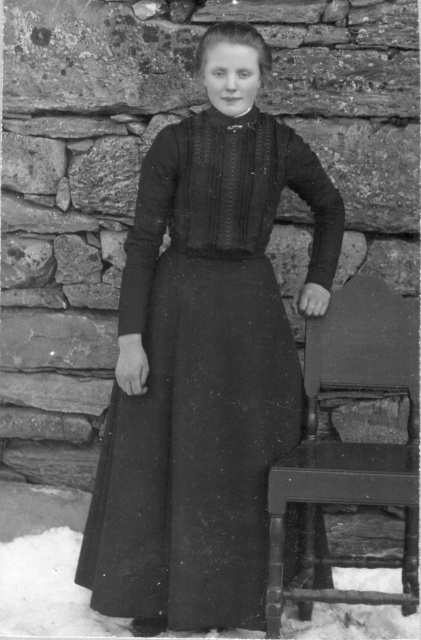
Question: Which of the following is the closest to the observer?

Choices:
 (A) (348, 342)
 (B) (255, 321)
 (C) (90, 627)

Answer: (B)

Question: Is black matte dress at center positioned in front of dark wood chair at right?

Choices:
 (A) yes
 (B) no

Answer: (B)

Question: Can you confirm if black matte dress at center is wider than white powdery snow at lower left?

Choices:
 (A) no
 (B) yes

Answer: (A)

Question: Which object appears closest to the camera in this image?

Choices:
 (A) dark wood chair at right
 (B) white powdery snow at lower left
 (C) black matte dress at center

Answer: (A)

Question: Which of the following is the farthest from the observer?

Choices:
 (A) (212, 321)
 (B) (327, 624)
 (C) (346, 326)

Answer: (C)

Question: Is the position of dark wood chair at right more distant than that of white powdery snow at lower left?

Choices:
 (A) no
 (B) yes

Answer: (A)